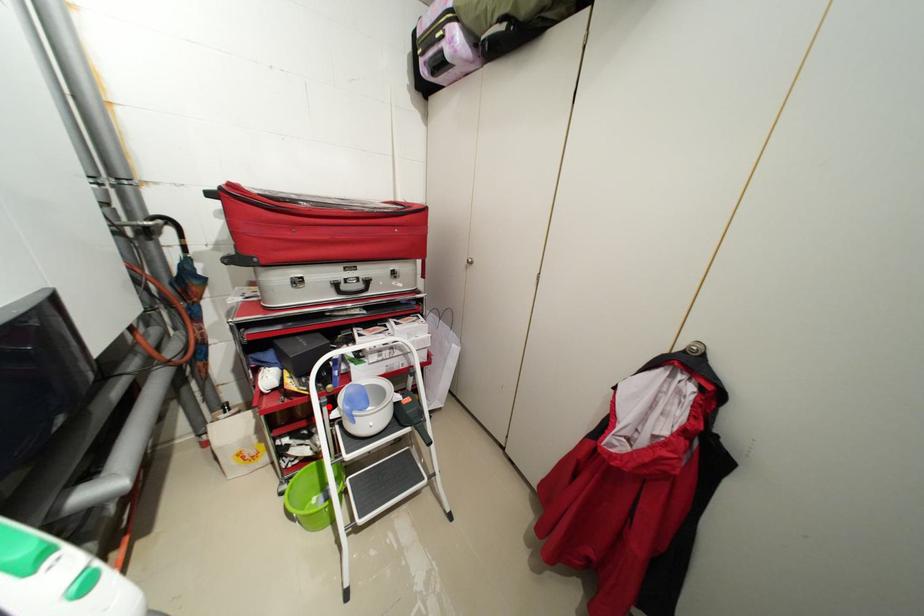
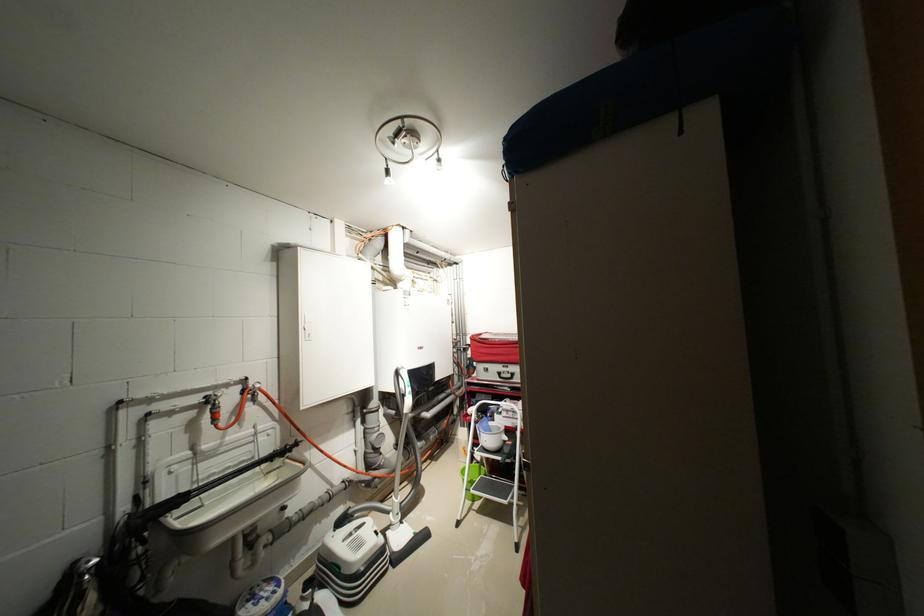
Question: I am providing you with two images of the same scene from different viewpoints. Image1 has a red point marked. In image2, the corresponding 3D location appears at what relative position? Reply with the corresponding letter.

Choices:
 (A) Closer
 (B) Farther

Answer: (B)